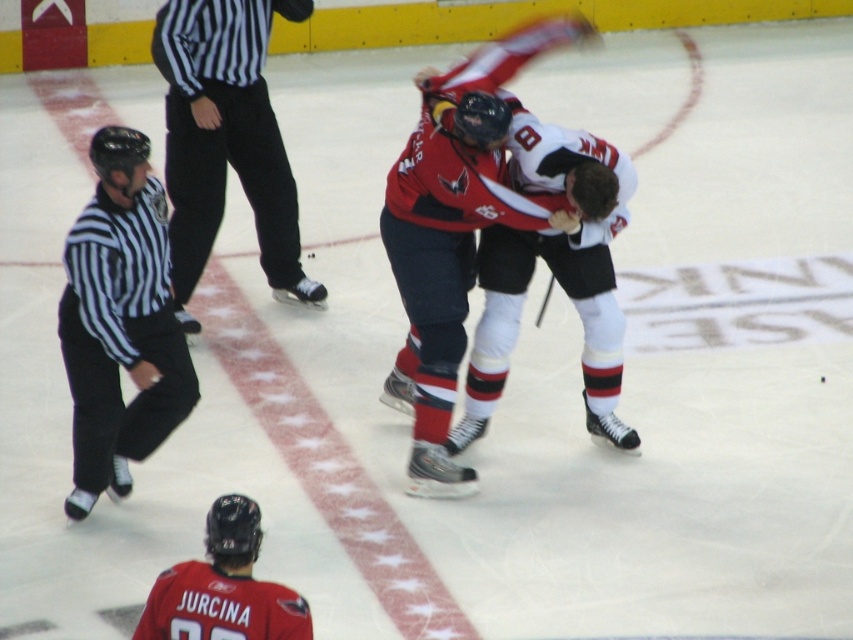
Is striped jersey referee at left in front of black striped shirt at upper left?

Yes, striped jersey referee at left is closer to the viewer.

Can you confirm if striped jersey referee at left is positioned to the right of black striped shirt at upper left?

In fact, striped jersey referee at left is to the left of black striped shirt at upper left.

Where is `striped jersey referee at left`? striped jersey referee at left is located at coordinates (120, 323).

Can you confirm if striped jersey referee at left is positioned to the right of red jersey at center?

Incorrect, striped jersey referee at left is not on the right side of red jersey at center.

Is striped jersey referee at left shorter than red jersey at center?

Yes.

This screenshot has width=853, height=640. I want to click on striped jersey referee at left, so click(120, 323).

Is black striped shirt at upper left shorter than red jersey at center?

Incorrect, black striped shirt at upper left's height does not fall short of red jersey at center's.

Who is more distant from viewer, (268, 237) or (590, 141)?

The point (268, 237) is behind.

Locate an element on the screen. The height and width of the screenshot is (640, 853). black striped shirt at upper left is located at coordinates (225, 140).